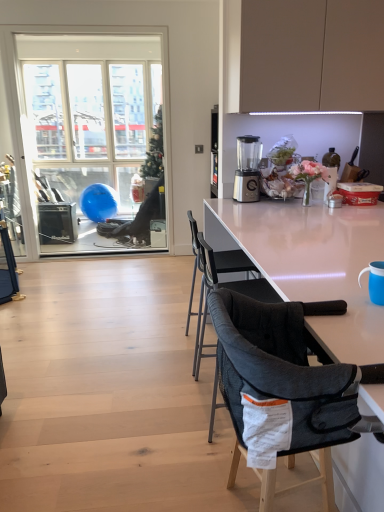
Question: Is clear glass window at left not inside dark gray mesh chair at center, the second chair viewed from the back?

Choices:
 (A) no
 (B) yes

Answer: (B)

Question: Is clear glass window at left smaller than dark gray mesh chair at center, the second chair viewed from the back?

Choices:
 (A) no
 (B) yes

Answer: (A)

Question: Considering the relative sizes of clear glass window at left and dark gray mesh chair at center, the second chair viewed from the back, in the image provided, is clear glass window at left taller than dark gray mesh chair at center, the second chair viewed from the back,?

Choices:
 (A) no
 (B) yes

Answer: (B)

Question: Is clear glass window at left directly adjacent to dark gray mesh chair at center, the 1th chair viewed from the front?

Choices:
 (A) yes
 (B) no

Answer: (B)

Question: Is clear glass window at left facing away from dark gray mesh chair at center, the 1th chair viewed from the front?

Choices:
 (A) yes
 (B) no

Answer: (B)

Question: Is dark gray mesh chair at center, the second chair viewed from the back, inside clear glass window at left?

Choices:
 (A) yes
 (B) no

Answer: (B)

Question: Is sleek silver blender at center facing away from clear glass window at left?

Choices:
 (A) no
 (B) yes

Answer: (B)

Question: Could you tell me if sleek silver blender at center is turned towards clear glass window at left?

Choices:
 (A) yes
 (B) no

Answer: (B)

Question: Is sleek silver blender at center outside clear glass window at left?

Choices:
 (A) no
 (B) yes

Answer: (B)

Question: Is sleek silver blender at center positioned far away from clear glass window at left?

Choices:
 (A) no
 (B) yes

Answer: (B)

Question: Can you confirm if sleek silver blender at center is taller than clear glass window at left?

Choices:
 (A) yes
 (B) no

Answer: (B)

Question: Is sleek silver blender at center closer to camera compared to clear glass window at left?

Choices:
 (A) yes
 (B) no

Answer: (A)

Question: Is white glossy table at center closer to the viewer compared to clear glass window at left?

Choices:
 (A) yes
 (B) no

Answer: (A)